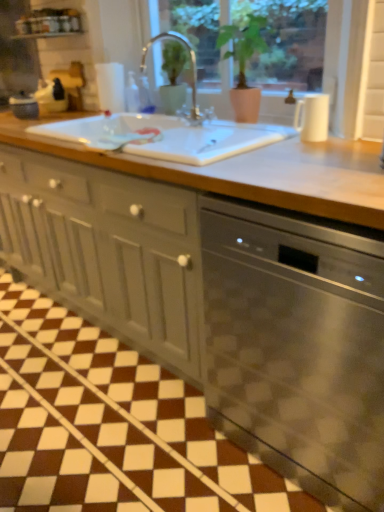
Question: Is matte gray cabinet at center positioned with its back to stainless steel dishwasher at center?

Choices:
 (A) no
 (B) yes

Answer: (A)

Question: Is matte gray cabinet at center taller than stainless steel dishwasher at center?

Choices:
 (A) yes
 (B) no

Answer: (A)

Question: Does matte gray cabinet at center have a greater width compared to stainless steel dishwasher at center?

Choices:
 (A) yes
 (B) no

Answer: (A)

Question: Could you tell me if matte gray cabinet at center is turned towards stainless steel dishwasher at center?

Choices:
 (A) yes
 (B) no

Answer: (B)

Question: From a real-world perspective, is matte gray cabinet at center below stainless steel dishwasher at center?

Choices:
 (A) yes
 (B) no

Answer: (B)

Question: Is matte gray cabinet at center surrounding stainless steel dishwasher at center?

Choices:
 (A) no
 (B) yes

Answer: (A)

Question: Does matte black kettle at left, the 2th appliance from the right, appear on the left side of stainless steel dishwasher at center?

Choices:
 (A) yes
 (B) no

Answer: (A)

Question: Can you confirm if matte black kettle at left, which is the 1th appliance from back to front, is bigger than stainless steel dishwasher at center?

Choices:
 (A) yes
 (B) no

Answer: (B)

Question: Could stainless steel dishwasher at center be considered to be inside matte black kettle at left, marked as the 2th appliance in a front-to-back arrangement?

Choices:
 (A) yes
 (B) no

Answer: (B)

Question: Is matte black kettle at left, marked as the 2th appliance in a front-to-back arrangement, not inside stainless steel dishwasher at center?

Choices:
 (A) yes
 (B) no

Answer: (A)

Question: Is matte black kettle at left, the 2th appliance from the bottom, looking in the opposite direction of stainless steel dishwasher at center?

Choices:
 (A) no
 (B) yes

Answer: (A)

Question: Considering the relative sizes of matte black kettle at left, the first appliance positioned from the left, and stainless steel dishwasher at center in the image provided, is matte black kettle at left, the first appliance positioned from the left, thinner than stainless steel dishwasher at center?

Choices:
 (A) no
 (B) yes

Answer: (B)

Question: Is satin nickel faucet at center at the left side of white glossy window sill at upper center?

Choices:
 (A) no
 (B) yes

Answer: (A)